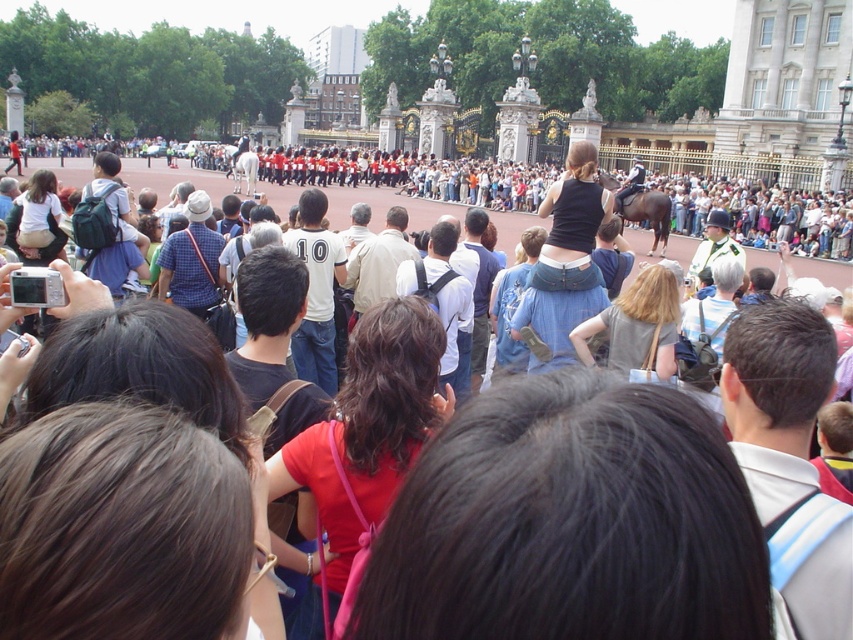
Between gray fabric shirt at center and matte white shirt at center, which one is positioned lower?

gray fabric shirt at center

In the scene shown: Is the position of gray fabric shirt at center less distant than that of matte white shirt at center?

Yes, gray fabric shirt at center is closer to the viewer.

Locate an element on the screen. gray fabric shirt at center is located at coordinates (637, 324).

The height and width of the screenshot is (640, 853). What do you see at coordinates (367, 433) in the screenshot? I see `matte red shirt at center` at bounding box center [367, 433].

Which is in front, point (303, 461) or point (48, 236)?

Point (303, 461) is more forward.

You are a GUI agent. You are given a task and a screenshot of the screen. Output one action in this format:
    pyautogui.click(x=<x>, y=<y>)
    Task: Click on the matte red shirt at center
    Image resolution: width=853 pixels, height=640 pixels.
    Given the screenshot: What is the action you would take?
    pyautogui.click(x=367, y=433)

Locate an element on the screen. matte red shirt at center is located at coordinates (367, 433).

Consider the image. Is matte red shirt at center wider than gray fabric shirt at center?

Yes, matte red shirt at center is wider than gray fabric shirt at center.

Locate an element on the screen. The width and height of the screenshot is (853, 640). matte red shirt at center is located at coordinates click(367, 433).

You are a GUI agent. You are given a task and a screenshot of the screen. Output one action in this format:
    pyautogui.click(x=<x>, y=<y>)
    Task: Click on the matte red shirt at center
    
    Given the screenshot: What is the action you would take?
    pyautogui.click(x=367, y=433)